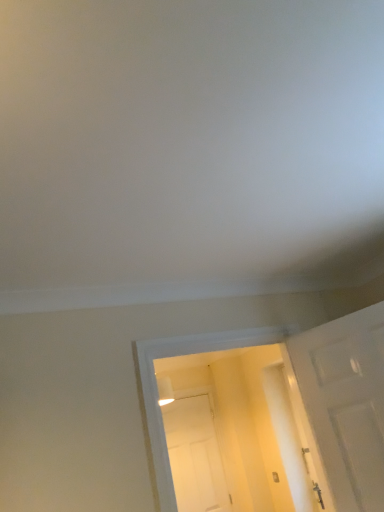
Question: Considering the positions of point (347, 333) and point (173, 438), is point (347, 333) closer or farther from the camera than point (173, 438)?

Choices:
 (A) closer
 (B) farther

Answer: (A)

Question: From a real-world perspective, is white matte door at right, arranged as the second door when ordered from the bottom, positioned above or below white matte door at center, marked as the first door in a left-to-right arrangement?

Choices:
 (A) above
 (B) below

Answer: (A)

Question: In the image, is white matte door at right, which ranks as the first door in top-to-bottom order, on the left side or the right side of white matte door at center, the second door when ordered from front to back?

Choices:
 (A) right
 (B) left

Answer: (A)

Question: Is white matte door at center, which appears as the second door when viewed from the right, in front of or behind white matte door at right, arranged as the second door when ordered from the bottom, in the image?

Choices:
 (A) front
 (B) behind

Answer: (B)

Question: From the image's perspective, is white matte door at center, marked as the first door in a left-to-right arrangement, located above or below white matte door at right, the second door positioned from the back?

Choices:
 (A) above
 (B) below

Answer: (B)

Question: Is white matte door at center, the first door ordered from the bottom, to the left or to the right of white matte door at right, which ranks as the first door in top-to-bottom order, in the image?

Choices:
 (A) left
 (B) right

Answer: (A)

Question: Considering the positions of point (198, 445) and point (324, 330), is point (198, 445) closer or farther from the camera than point (324, 330)?

Choices:
 (A) farther
 (B) closer

Answer: (A)